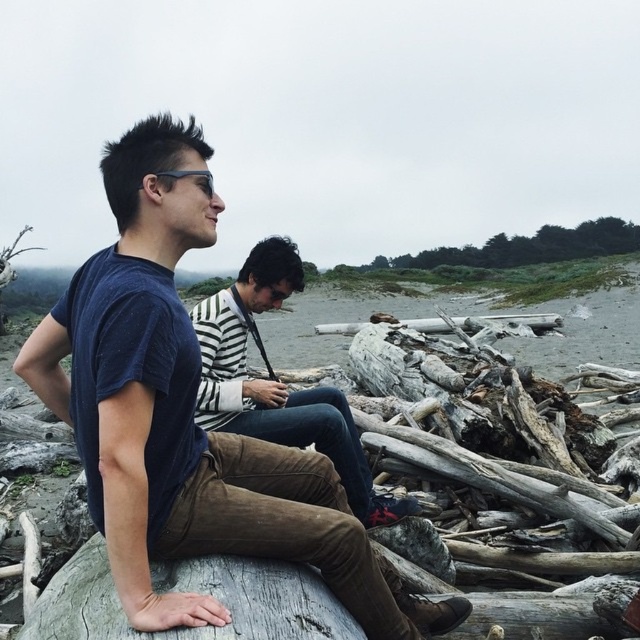
Question: Is matte blue t-shirt at center further to camera compared to striped sweater at center?

Choices:
 (A) no
 (B) yes

Answer: (A)

Question: Which point appears farthest from the camera in this image?

Choices:
 (A) (208, 385)
 (B) (156, 164)

Answer: (A)

Question: Can you confirm if matte blue t-shirt at center is wider than striped sweater at center?

Choices:
 (A) no
 (B) yes

Answer: (B)

Question: Among these points, which one is farthest from the camera?

Choices:
 (A) (248, 460)
 (B) (216, 321)

Answer: (B)

Question: Among these objects, which one is nearest to the camera?

Choices:
 (A) striped sweater at center
 (B) matte blue t-shirt at center

Answer: (B)

Question: Can you confirm if matte blue t-shirt at center is positioned below striped sweater at center?

Choices:
 (A) no
 (B) yes

Answer: (B)